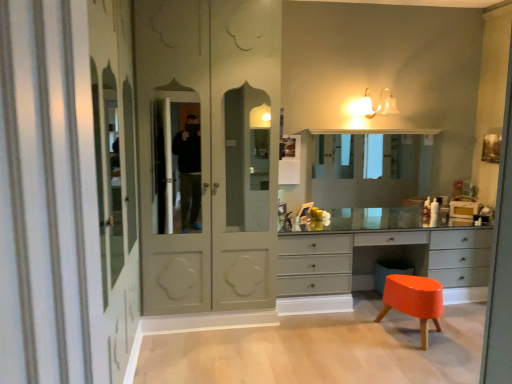
Describe the element at coordinates (369, 260) in the screenshot. I see `matte gray chest of drawers at center` at that location.

At what (x,y) coordinates should I click in order to perform the action: click on matte glass sconce at upper center. Please return your answer as a coordinate pair (x, y). The width and height of the screenshot is (512, 384). Looking at the image, I should click on (377, 107).

Is matte white wardrobe at center positioned before matte gray chest of drawers at center?

That is True.

Is matte white wardrobe at center touching matte gray chest of drawers at center?

No, matte white wardrobe at center is not with matte gray chest of drawers at center.

What's the angular difference between matte white wardrobe at center and matte gray chest of drawers at center's facing directions?

The angle between the facing direction of matte white wardrobe at center and the facing direction of matte gray chest of drawers at center is 0.144 degrees.

Considering the relative sizes of matte white wardrobe at center and matte gray chest of drawers at center in the image provided, is matte white wardrobe at center wider than matte gray chest of drawers at center?

Yes.

Considering the positions of objects orange glossy stool at lower right and clear glass medicine cabinet at center in the image provided, who is more to the left, orange glossy stool at lower right or clear glass medicine cabinet at center?

From the viewer's perspective, clear glass medicine cabinet at center appears more on the left side.

Can you tell me how much orange glossy stool at lower right and clear glass medicine cabinet at center differ in facing direction?

They differ by 177 degrees in their facing directions.

From a real-world perspective, is orange glossy stool at lower right positioned under clear glass medicine cabinet at center based on gravity?

Yes, from a real-world perspective, orange glossy stool at lower right is beneath clear glass medicine cabinet at center.

Consider the image. Can we say orange glossy stool at lower right lies outside clear glass medicine cabinet at center?

Yes, orange glossy stool at lower right is not within clear glass medicine cabinet at center.

Is matte white wardrobe at center inside the boundaries of matte glass sconce at upper center, or outside?

matte white wardrobe at center is not inside matte glass sconce at upper center, it's outside.

In the scene shown: From the image's perspective, is matte white wardrobe at center beneath matte glass sconce at upper center?

Correct, matte white wardrobe at center appears lower than matte glass sconce at upper center in the image.

From a real-world perspective, which object rests below the other?

matte white wardrobe at center.

Can you confirm if matte white wardrobe at center is positioned to the right of matte glass sconce at upper center?

No, matte white wardrobe at center is not to the right of matte glass sconce at upper center.

From the image's perspective, who appears lower, matte gray chest of drawers at center or matte glass sconce at upper center?

matte gray chest of drawers at center, from the image's perspective.

Considering the sizes of objects matte gray chest of drawers at center and matte glass sconce at upper center in the image provided, who is smaller, matte gray chest of drawers at center or matte glass sconce at upper center?

Smaller between the two is matte glass sconce at upper center.

From a real-world perspective, which is physically below, matte gray chest of drawers at center or matte glass sconce at upper center?

matte gray chest of drawers at center is physically lower.

Is matte gray chest of drawers at center beside matte glass sconce at upper center?

matte gray chest of drawers at center is not next to matte glass sconce at upper center, and they're not touching.

Does point (481, 277) lie behind point (326, 168)?

No, it is in front of (326, 168).

Would you consider matte gray chest of drawers at center to be distant from clear glass medicine cabinet at center?

No, matte gray chest of drawers at center is in close proximity to clear glass medicine cabinet at center.

From a real-world perspective, is matte gray chest of drawers at center on top of clear glass medicine cabinet at center?

Actually, matte gray chest of drawers at center is physically below clear glass medicine cabinet at center in the real world.

From the image's perspective, who appears lower, orange glossy stool at lower right or matte glass sconce at upper center?

orange glossy stool at lower right.

This screenshot has width=512, height=384. Identify the location of stool in front of the matte glass sconce at upper center. (414, 300).

Considering the sizes of objects orange glossy stool at lower right and matte glass sconce at upper center in the image provided, who is taller, orange glossy stool at lower right or matte glass sconce at upper center?

orange glossy stool at lower right.

Could you tell me if orange glossy stool at lower right is turned towards matte white wardrobe at center?

No, orange glossy stool at lower right is not aimed at matte white wardrobe at center.

Is orange glossy stool at lower right not near matte white wardrobe at center?

That's right, there is a large distance between orange glossy stool at lower right and matte white wardrobe at center.

Considering their positions, is orange glossy stool at lower right located in front of or behind matte white wardrobe at center?

orange glossy stool at lower right is behind matte white wardrobe at center.

Considering the sizes of objects orange glossy stool at lower right and matte white wardrobe at center in the image provided, who is bigger, orange glossy stool at lower right or matte white wardrobe at center?

matte white wardrobe at center is bigger.

Identify the location of chest of drawers on the right of matte white wardrobe at center. The height and width of the screenshot is (384, 512). tap(369, 260).

Identify the location of stool lying below the clear glass medicine cabinet at center (from the image's perspective). (414, 300).

Based on their spatial positions, is matte white wardrobe at center or matte glass sconce at upper center further from orange glossy stool at lower right?

matte glass sconce at upper center is further to orange glossy stool at lower right.

Considering their positions, is matte gray chest of drawers at center positioned closer to orange glossy stool at lower right than matte white wardrobe at center?

Based on the image, matte gray chest of drawers at center appears to be nearer to orange glossy stool at lower right.

From the image, which object appears to be farther from matte gray chest of drawers at center, matte white wardrobe at center or matte glass sconce at upper center?

matte glass sconce at upper center is positioned further to the anchor matte gray chest of drawers at center.

When comparing their distances from orange glossy stool at lower right, does matte white wardrobe at center or matte gray chest of drawers at center seem further?

The object further to orange glossy stool at lower right is matte white wardrobe at center.

Estimate the real-world distances between objects in this image. Which object is closer to matte white wardrobe at center, matte gray chest of drawers at center or orange glossy stool at lower right?

Based on the image, matte gray chest of drawers at center appears to be nearer to matte white wardrobe at center.

Consider the image. Based on their spatial positions, is clear glass medicine cabinet at center or matte glass sconce at upper center closer to orange glossy stool at lower right?

Among the two, clear glass medicine cabinet at center is located nearer to orange glossy stool at lower right.

Which object lies further to the anchor point matte gray chest of drawers at center, matte white wardrobe at center or orange glossy stool at lower right?

Among the two, matte white wardrobe at center is located further to matte gray chest of drawers at center.

When comparing their distances from matte white wardrobe at center, does clear glass medicine cabinet at center or matte gray chest of drawers at center seem further?

clear glass medicine cabinet at center is further to matte white wardrobe at center.

What are the coordinates of `light fixture located between matte white wardrobe at center and clear glass medicine cabinet at center in the left-right direction` in the screenshot? It's located at (377, 107).

I want to click on medicine cabinet between matte glass sconce at upper center and orange glossy stool at lower right in the vertical direction, so click(362, 171).

Identify the location of medicine cabinet between matte glass sconce at upper center and matte gray chest of drawers at center vertically. The width and height of the screenshot is (512, 384). (362, 171).

The width and height of the screenshot is (512, 384). Find the location of `chest of drawers between matte white wardrobe at center and orange glossy stool at lower right in the horizontal direction`. chest of drawers between matte white wardrobe at center and orange glossy stool at lower right in the horizontal direction is located at coordinates (369, 260).